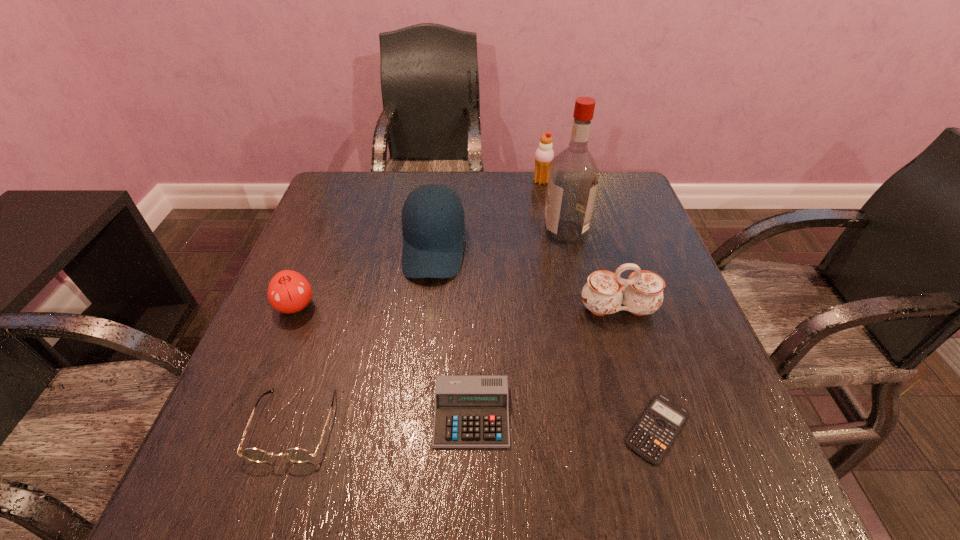
The height and width of the screenshot is (540, 960). Find the location of `free region that satisfies the following two spatial constraints: 1. by the handle of the shorter calculator; 2. on the right side of the chinaware`. free region that satisfies the following two spatial constraints: 1. by the handle of the shorter calculator; 2. on the right side of the chinaware is located at coordinates (654, 428).

Locate an element on the screen. This screenshot has width=960, height=540. vacant area in the image that satisfies the following two spatial constraints: 1. by the handle of the shorter calculator; 2. on the left side of the chinaware is located at coordinates (654, 428).

What are the coordinates of `free location that satisfies the following two spatial constraints: 1. on the front-facing side of the liquor; 2. on the left side of the right calculator` in the screenshot? It's located at (608, 428).

Image resolution: width=960 pixels, height=540 pixels. I want to click on vacant space that satisfies the following two spatial constraints: 1. at the front with a straw on the farthest object; 2. on the left side of the shortest object, so [x=588, y=428].

This screenshot has height=540, width=960. Identify the location of vacant space that satisfies the following two spatial constraints: 1. on the front-facing side of the tallest object; 2. on the front-facing side of the baseball cap. [x=568, y=248].